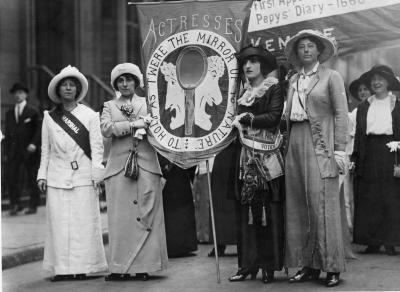
You are a GUI agent. You are given a task and a screenshot of the screen. Output one action in this format:
    pyautogui.click(x=<x>, y=<y>)
    Task: Click on the mirror
    The width and height of the screenshot is (400, 292).
    Given the screenshot: What is the action you would take?
    pyautogui.click(x=189, y=70)